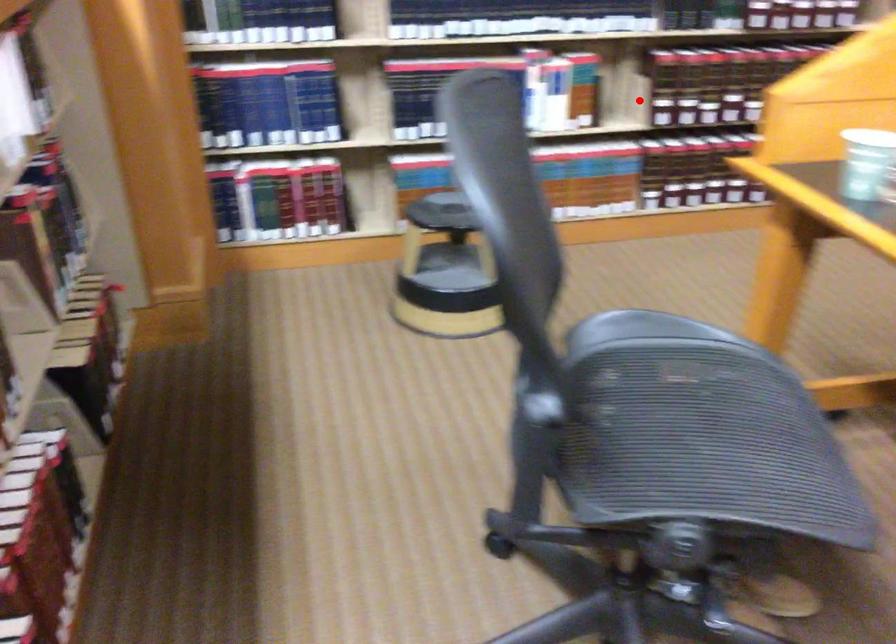
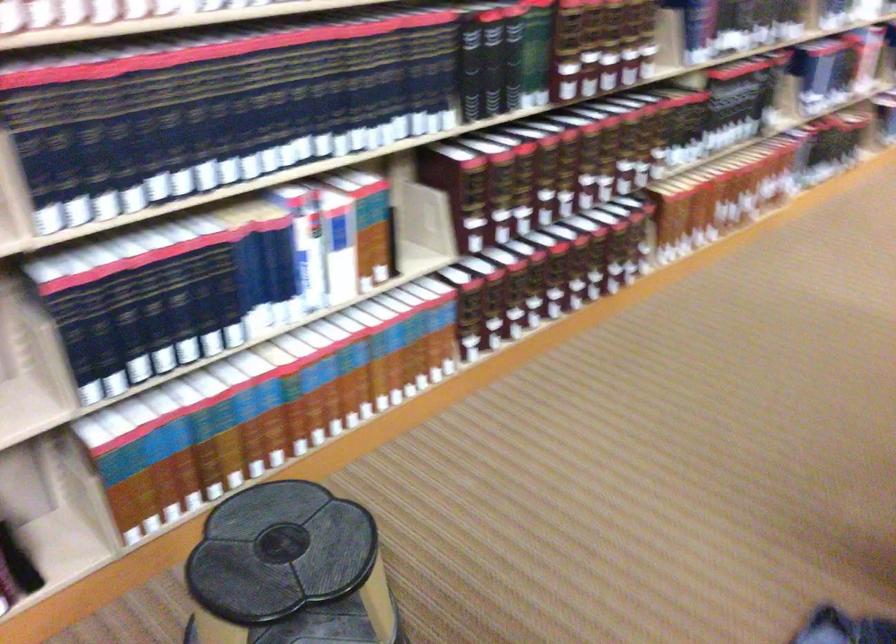
Question: I am providing you with two images of the same scene from different viewpoints. Image1 has a red point marked. In image2, the corresponding 3D location appears at what relative position? Reply with the corresponding letter.

Choices:
 (A) Closer
 (B) Farther

Answer: (A)